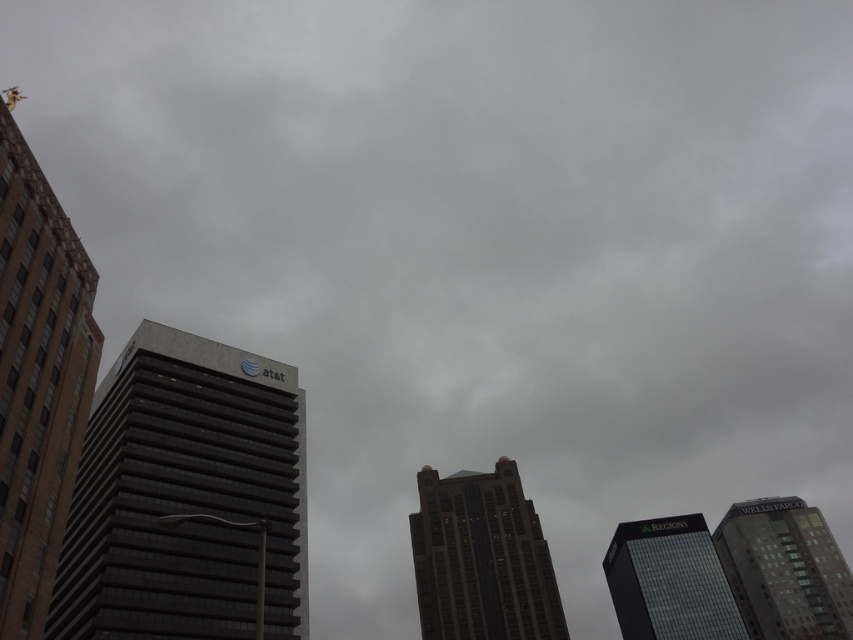
Question: Is dark glass skyscraper at center closer to camera compared to glassy black skyscraper at lower right?

Choices:
 (A) no
 (B) yes

Answer: (B)

Question: Considering the real-world distances, which object is closest to the glassy gray skyscraper at lower right?

Choices:
 (A) dark glass skyscraper at center
 (B) glassy black skyscraper at lower right
 (C) brown glass skyscraper at left

Answer: (B)

Question: Among these points, which one is farthest from the camera?

Choices:
 (A) (840, 554)
 (B) (0, 596)

Answer: (A)

Question: Is gray glass building at center bigger than brown glass skyscraper at left?

Choices:
 (A) no
 (B) yes

Answer: (B)

Question: Which of the following is the farthest from the observer?

Choices:
 (A) brown glass skyscraper at left
 (B) glassy black skyscraper at lower right
 (C) dark glass skyscraper at center

Answer: (B)

Question: Is gray glass building at center further to the viewer compared to dark glass skyscraper at center?

Choices:
 (A) no
 (B) yes

Answer: (A)